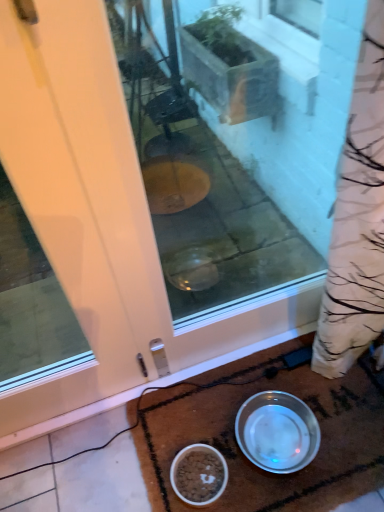
You are a GUI agent. You are given a task and a screenshot of the screen. Output one action in this format:
    pyautogui.click(x=<x>, y=<y>)
    Task: Click on the free space in front of white glossy door at center
    
    Given the screenshot: What is the action you would take?
    pyautogui.click(x=82, y=463)